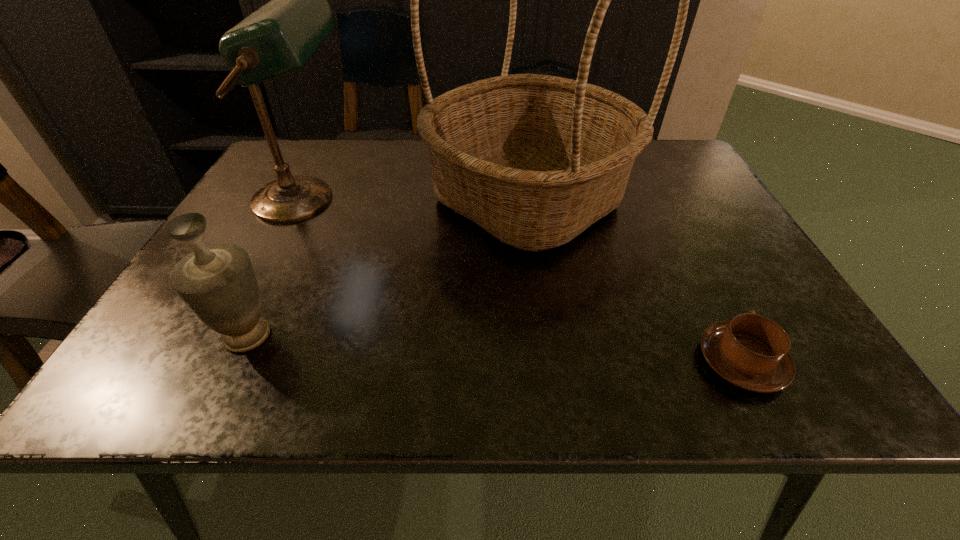
Find the location of a particular element. The width and height of the screenshot is (960, 540). vacant area that satisfies the following two spatial constraints: 1. on the side of the rightmost object with the handle; 2. above the green lampshade of the table lamp is located at coordinates (659, 200).

Find the location of a particular element. This screenshot has width=960, height=540. free space that satisfies the following two spatial constraints: 1. above the green lampshade of the second tallest object; 2. on the side of the shortest object with the handle is located at coordinates (224, 362).

You are a GUI agent. You are given a task and a screenshot of the screen. Output one action in this format:
    pyautogui.click(x=<x>, y=<y>)
    Task: Click on the free spot that satisfies the following two spatial constraints: 1. above the green lampshade of the urn; 2. on the right side of the second tallest object
    This screenshot has width=960, height=540.
    Given the screenshot: What is the action you would take?
    pyautogui.click(x=237, y=335)

The image size is (960, 540). I want to click on vacant space that satisfies the following two spatial constraints: 1. on the side of the cappuccino with the handle; 2. above the green lampshade of the third shortest object, so click(659, 200).

What are the coordinates of `vacant area that satisfies the following two spatial constraints: 1. above the green lampshade of the third shortest object; 2. on the side of the rightmost object with the handle` in the screenshot? It's located at (224, 362).

The image size is (960, 540). In order to click on blank space that satisfies the following two spatial constraints: 1. above the green lampshade of the table lamp; 2. on the side of the rightmost object with the handle in this screenshot , I will do pyautogui.click(x=224, y=362).

Identify the location of vacant region that satisfies the following two spatial constraints: 1. on the side of the rightmost object with the handle; 2. above the green lampshade of the table lamp. (659, 200).